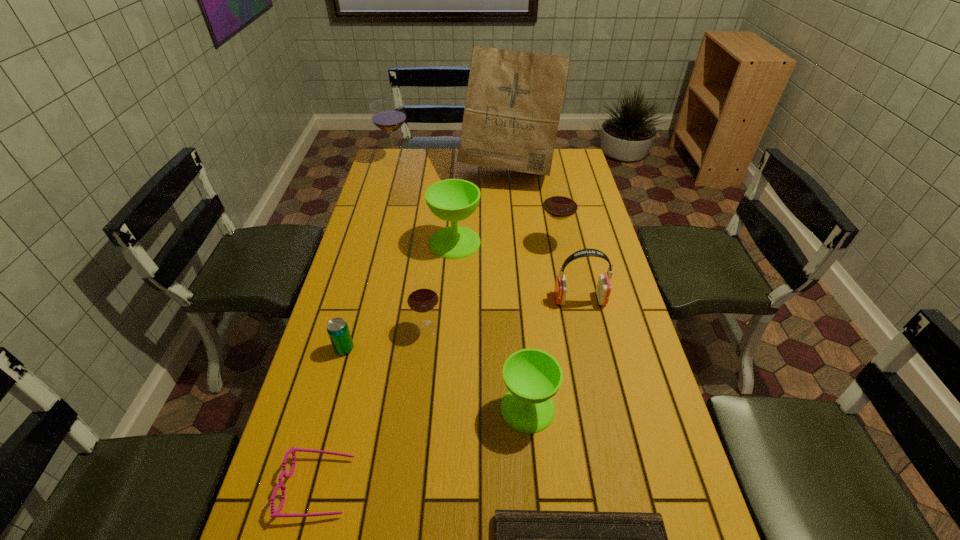
This screenshot has height=540, width=960. I want to click on wineglass present at the far edge, so click(388, 115).

Find the location of a particular element. The height and width of the screenshot is (540, 960). wineglass present at the left edge is located at coordinates coord(388,115).

Locate an element on the screen. The image size is (960, 540). beer can that is at the left edge is located at coordinates (337, 329).

Image resolution: width=960 pixels, height=540 pixels. I want to click on spectacles that is at the left edge, so click(x=274, y=513).

Image resolution: width=960 pixels, height=540 pixels. I want to click on grocery bag located at the right edge, so click(x=514, y=99).

Locate an element on the screen. The image size is (960, 540). wineglass at the right edge is located at coordinates (561, 202).

This screenshot has height=540, width=960. I want to click on earphone at the right edge, so click(x=603, y=289).

I want to click on object situated at the far left corner, so click(388, 115).

The height and width of the screenshot is (540, 960). In order to click on object present at the far right corner in this screenshot , I will do `click(514, 99)`.

What are the coordinates of `free space at the far edge of the desktop` in the screenshot? It's located at (436, 172).